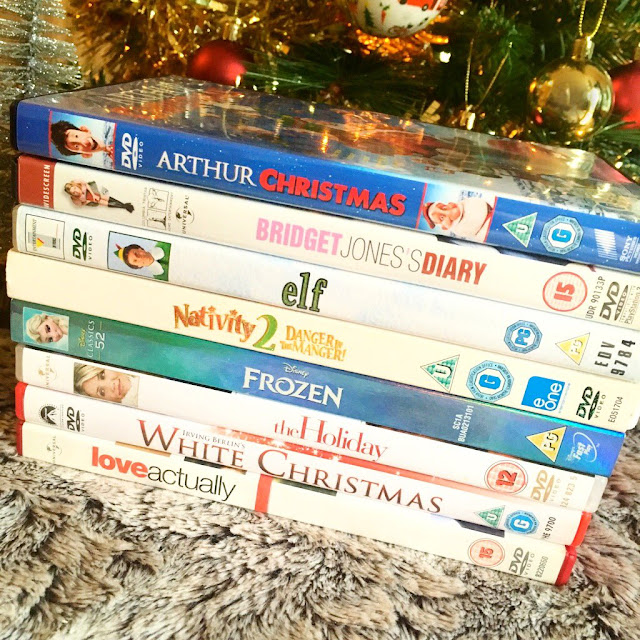
At what (x,y) coordinates should I click in order to perform the action: click on dvd's. Please return your answer as a coordinate pair (x, y). This screenshot has width=640, height=640. Looking at the image, I should click on (232, 166), (232, 218), (232, 271), (230, 320), (223, 363), (221, 412), (221, 445), (219, 493).